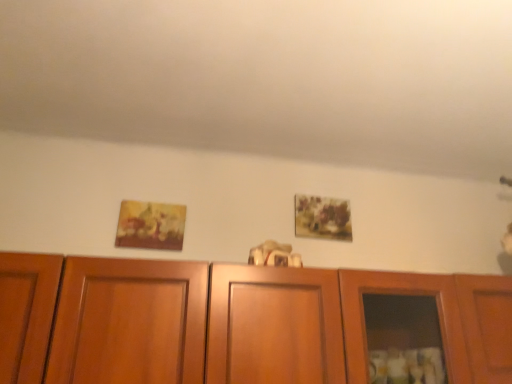
What do you see at coordinates (322, 218) in the screenshot? I see `matte floral painting at upper center, placed as the 2th picture frame when sorted from left to right` at bounding box center [322, 218].

I want to click on matte floral painting at upper center, placed as the 2th picture frame when sorted from left to right, so click(x=322, y=218).

Considering the positions of point (316, 226) and point (360, 355), is point (316, 226) closer or farther from the camera than point (360, 355)?

Point (316, 226) appears to be farther away from the viewer than point (360, 355).

In the scene shown: Can you confirm if matte floral painting at upper center, the first picture frame viewed from the back, is positioned to the left of wooden cabinet at center?

Incorrect, matte floral painting at upper center, the first picture frame viewed from the back, is not on the left side of wooden cabinet at center.

Is matte floral painting at upper center, the first picture frame viewed from the back, facing towards wooden cabinet at center?

No, matte floral painting at upper center, the first picture frame viewed from the back, is not aimed at wooden cabinet at center.

Is wooden cabinet at center to the right of matte yellow painting at left, positioned as the second picture frame in right-to-left order, from the viewer's perspective?

Correct, you'll find wooden cabinet at center to the right of matte yellow painting at left, positioned as the second picture frame in right-to-left order.

How different are the orientations of wooden cabinet at center and matte yellow painting at left, positioned as the second picture frame in back-to-front order, in degrees?

The angle between the facing direction of wooden cabinet at center and the facing direction of matte yellow painting at left, positioned as the second picture frame in back-to-front order, is 0.183 degrees.

In terms of height, does wooden cabinet at center look taller or shorter compared to matte yellow painting at left, which is the first picture frame in left-to-right order?

Considering their sizes, wooden cabinet at center has more height than matte yellow painting at left, which is the first picture frame in left-to-right order.

Is wooden cabinet at center not close to matte yellow painting at left, positioned as the second picture frame in back-to-front order?

They are positioned close to each other.

Based on their positions, is matte yellow painting at left, placed as the 1th picture frame when sorted from front to back, located to the left or right of wooden cabinet at center?

matte yellow painting at left, placed as the 1th picture frame when sorted from front to back, is to the left of wooden cabinet at center.

Consider the image. In terms of size, does matte yellow painting at left, positioned as the second picture frame in right-to-left order, appear bigger or smaller than wooden cabinet at center?

Considering their sizes, matte yellow painting at left, positioned as the second picture frame in right-to-left order, takes up less space than wooden cabinet at center.

Can we say matte yellow painting at left, placed as the 1th picture frame when sorted from front to back, lies outside wooden cabinet at center?

Absolutely, matte yellow painting at left, placed as the 1th picture frame when sorted from front to back, is external to wooden cabinet at center.

The width and height of the screenshot is (512, 384). What are the coordinates of `cabinetry located below the matte yellow painting at left, placed as the 1th picture frame when sorted from front to back (from the image's perspective)` in the screenshot? It's located at (247, 323).

In terms of size, does wooden cabinet at center appear bigger or smaller than matte floral painting at upper center, the first picture frame viewed from the back?

Considering their sizes, wooden cabinet at center takes up more space than matte floral painting at upper center, the first picture frame viewed from the back.

Looking at this image, from a real-world perspective, between wooden cabinet at center and matte floral painting at upper center, marked as the first picture frame in a right-to-left arrangement, who is vertically lower?

wooden cabinet at center.

Is wooden cabinet at center thinner than matte floral painting at upper center, the 2th picture frame positioned from the front?

No, wooden cabinet at center is not thinner than matte floral painting at upper center, the 2th picture frame positioned from the front.

In order to click on picture frame located on the right of matte yellow painting at left, positioned as the second picture frame in right-to-left order in this screenshot , I will do `click(322, 218)`.

Who is taller, matte yellow painting at left, which is the first picture frame in left-to-right order, or matte floral painting at upper center, the 2th picture frame positioned from the front?

Standing taller between the two is matte floral painting at upper center, the 2th picture frame positioned from the front.

Does point (165, 246) come in front of point (304, 195)?

That is True.

From the picture: Is matte yellow painting at left, positioned as the second picture frame in right-to-left order, outside of matte floral painting at upper center, the 2th picture frame positioned from the front?

Yes, matte yellow painting at left, positioned as the second picture frame in right-to-left order, is outside of matte floral painting at upper center, the 2th picture frame positioned from the front.

Is matte floral painting at upper center, marked as the first picture frame in a right-to-left arrangement, wider or thinner than matte yellow painting at left, positioned as the second picture frame in back-to-front order?

matte floral painting at upper center, marked as the first picture frame in a right-to-left arrangement, is thinner than matte yellow painting at left, positioned as the second picture frame in back-to-front order.

Find the location of a particular element. picture frame that is above the matte yellow painting at left, placed as the 1th picture frame when sorted from front to back (from the image's perspective) is located at coordinates click(x=322, y=218).

Is matte floral painting at upper center, marked as the first picture frame in a right-to-left arrangement, aimed at matte yellow painting at left, positioned as the second picture frame in back-to-front order?

No, matte floral painting at upper center, marked as the first picture frame in a right-to-left arrangement, is not oriented towards matte yellow painting at left, positioned as the second picture frame in back-to-front order.

How distant is matte floral painting at upper center, the first picture frame viewed from the back, from matte yellow painting at left, positioned as the second picture frame in back-to-front order?

matte floral painting at upper center, the first picture frame viewed from the back, is 57.26 centimeters from matte yellow painting at left, positioned as the second picture frame in back-to-front order.

What are the coordinates of `cabinetry that appears below the matte floral painting at upper center, placed as the 2th picture frame when sorted from left to right (from the image's perspective)` in the screenshot? It's located at (247, 323).

The image size is (512, 384). What are the coordinates of `cabinetry in front of the matte yellow painting at left, positioned as the second picture frame in right-to-left order` in the screenshot? It's located at (247, 323).

Based on their spatial positions, is matte yellow painting at left, positioned as the second picture frame in back-to-front order, or wooden cabinet at center further from matte floral painting at upper center, placed as the 2th picture frame when sorted from left to right?

matte yellow painting at left, positioned as the second picture frame in back-to-front order.

Based on their spatial positions, is matte floral painting at upper center, the first picture frame viewed from the back, or wooden cabinet at center further from matte yellow painting at left, placed as the 1th picture frame when sorted from front to back?

Among the two, wooden cabinet at center is located further to matte yellow painting at left, placed as the 1th picture frame when sorted from front to back.

Looking at this image, looking at the image, which one is located closer to matte floral painting at upper center, the 2th picture frame positioned from the front, wooden cabinet at center or matte yellow painting at left, which is the first picture frame in left-to-right order?

The object closer to matte floral painting at upper center, the 2th picture frame positioned from the front, is wooden cabinet at center.

From the image, which object appears to be nearer to wooden cabinet at center, matte floral painting at upper center, the first picture frame viewed from the back, or matte yellow painting at left, positioned as the second picture frame in back-to-front order?

Based on the image, matte floral painting at upper center, the first picture frame viewed from the back, appears to be nearer to wooden cabinet at center.

Considering their positions, is wooden cabinet at center positioned closer to matte yellow painting at left, positioned as the second picture frame in back-to-front order, than matte floral painting at upper center, marked as the first picture frame in a right-to-left arrangement?

matte floral painting at upper center, marked as the first picture frame in a right-to-left arrangement.

Looking at the image, which one is located closer to wooden cabinet at center, matte yellow painting at left, which is the first picture frame in left-to-right order, or matte floral painting at upper center, the 2th picture frame positioned from the front?

matte floral painting at upper center, the 2th picture frame positioned from the front, is closer to wooden cabinet at center.

This screenshot has height=384, width=512. Identify the location of picture frame between wooden cabinet at center and matte floral painting at upper center, the first picture frame viewed from the back, in the front-back direction. (151, 225).